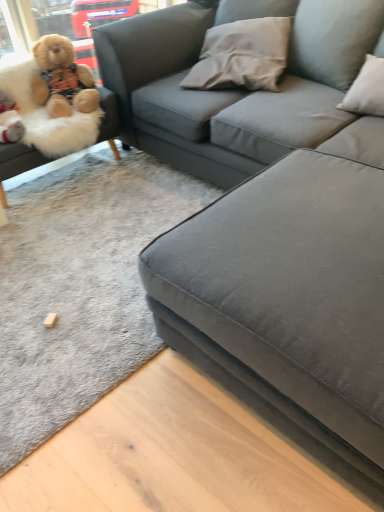
Question: Is fluffy beige teddy bear at upper left smaller than fluffy beige teddy bear at left, which is counted as the first studio couch, starting from the left?

Choices:
 (A) no
 (B) yes

Answer: (B)

Question: Considering the relative sizes of fluffy beige teddy bear at upper left and fluffy beige teddy bear at left, which is counted as the first studio couch, starting from the left, in the image provided, is fluffy beige teddy bear at upper left taller than fluffy beige teddy bear at left, which is counted as the first studio couch, starting from the left,?

Choices:
 (A) no
 (B) yes

Answer: (A)

Question: Is fluffy beige teddy bear at upper left not near fluffy beige teddy bear at left, the 2th studio couch viewed from the right?

Choices:
 (A) yes
 (B) no

Answer: (B)

Question: Considering the relative sizes of fluffy beige teddy bear at upper left and fluffy beige teddy bear at left, which is counted as the first studio couch, starting from the left, in the image provided, is fluffy beige teddy bear at upper left wider than fluffy beige teddy bear at left, which is counted as the first studio couch, starting from the left,?

Choices:
 (A) yes
 (B) no

Answer: (B)

Question: Is fluffy beige teddy bear at left, which is counted as the first studio couch, starting from the left, completely or partially inside fluffy beige teddy bear at upper left?

Choices:
 (A) no
 (B) yes

Answer: (A)

Question: Based on their sizes in the image, would you say suede gray couch at center, which ranks as the 2th studio couch in left-to-right order, is bigger or smaller than fluffy beige teddy bear at upper left?

Choices:
 (A) big
 (B) small

Answer: (A)

Question: From a real-world perspective, is suede gray couch at center, placed as the first studio couch when sorted from right to left, physically located above or below fluffy beige teddy bear at upper left?

Choices:
 (A) above
 (B) below

Answer: (B)

Question: Is suede gray couch at center, placed as the first studio couch when sorted from right to left, spatially inside fluffy beige teddy bear at upper left, or outside of it?

Choices:
 (A) inside
 (B) outside

Answer: (B)

Question: Is suede gray couch at center, which ranks as the 2th studio couch in left-to-right order, taller or shorter than fluffy beige teddy bear at upper left?

Choices:
 (A) tall
 (B) short

Answer: (A)

Question: Does point (1, 186) appear closer or farther from the camera than point (271, 48)?

Choices:
 (A) closer
 (B) farther

Answer: (A)

Question: Based on their positions, is fluffy beige teddy bear at left, which is counted as the first studio couch, starting from the left, located to the left or right of gray fabric pillow at upper center?

Choices:
 (A) right
 (B) left

Answer: (B)

Question: Is fluffy beige teddy bear at left, the 2th studio couch viewed from the right, wider or thinner than gray fabric pillow at upper center?

Choices:
 (A) wide
 (B) thin

Answer: (A)

Question: Is fluffy beige teddy bear at left, which is counted as the first studio couch, starting from the left, inside or outside of gray fabric pillow at upper center?

Choices:
 (A) outside
 (B) inside

Answer: (A)

Question: In terms of size, does gray fabric pillow at upper center appear bigger or smaller than fluffy beige teddy bear at left, which is counted as the first studio couch, starting from the left?

Choices:
 (A) big
 (B) small

Answer: (B)

Question: Looking at their shapes, would you say gray fabric pillow at upper center is wider or thinner than fluffy beige teddy bear at left, which is counted as the first studio couch, starting from the left?

Choices:
 (A) thin
 (B) wide

Answer: (A)